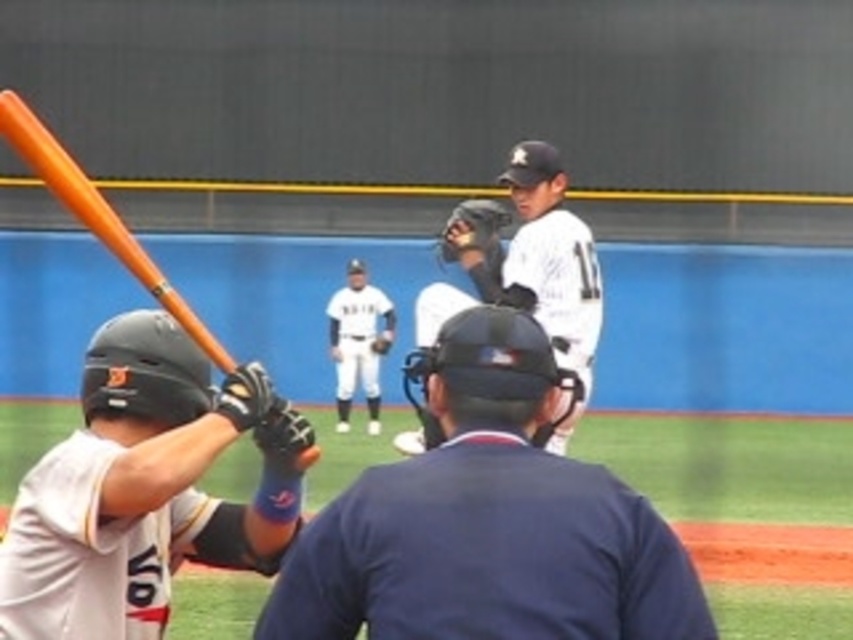
Describe the element at coordinates (486, 522) in the screenshot. Image resolution: width=853 pixels, height=640 pixels. I see `dark blue textured shirt at center` at that location.

Who is more forward, (x=468, y=387) or (x=82, y=182)?

Point (x=82, y=182) is in front.

The image size is (853, 640). Describe the element at coordinates (486, 522) in the screenshot. I see `dark blue textured shirt at center` at that location.

Locate an element on the screen. The width and height of the screenshot is (853, 640). dark blue textured shirt at center is located at coordinates (486, 522).

Between white matte baseball glove at upper center and black leather baseball glove at center, which one has less height?

With less height is white matte baseball glove at upper center.

Does white matte baseball glove at upper center have a larger size compared to black leather baseball glove at center?

Actually, white matte baseball glove at upper center might be smaller than black leather baseball glove at center.

Who is more distant from viewer, [587,234] or [480,228]?

Point [480,228]

Identify the location of white matte baseball glove at upper center. (543, 266).

Is matte black helmet at lower left in front of white uniform at center?

Yes.

Image resolution: width=853 pixels, height=640 pixels. In order to click on matte black helmet at lower left in this screenshot , I will do `click(142, 488)`.

You are a GUI agent. You are given a task and a screenshot of the screen. Output one action in this format:
    pyautogui.click(x=<x>, y=<y>)
    Task: Click on the matte black helmet at lower left
    This screenshot has height=640, width=853.
    Given the screenshot: What is the action you would take?
    pyautogui.click(x=142, y=488)